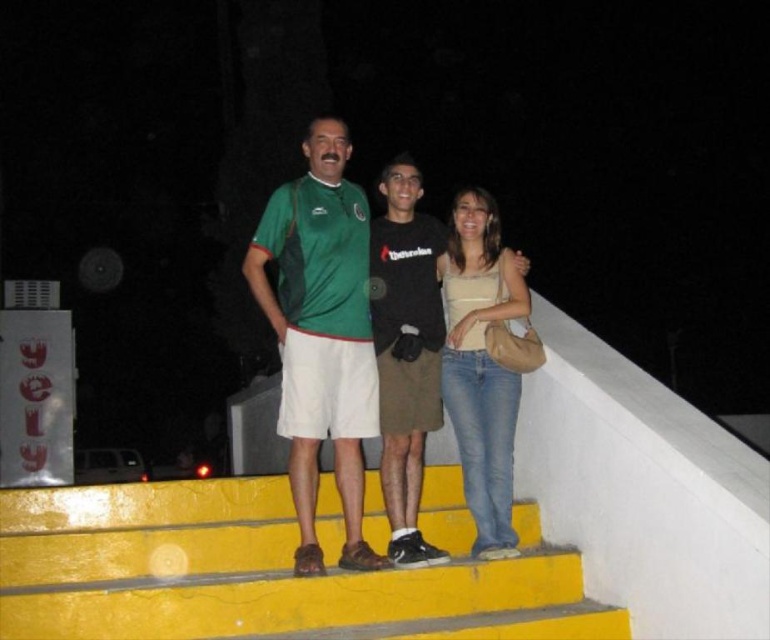
Question: Which object is positioned closest to the yellow painted stairs at center?

Choices:
 (A) green fabric shirt at center
 (B) black cotton shirt at center

Answer: (B)

Question: Considering the real-world distances, which object is closest to the denim jeans at center?

Choices:
 (A) black cotton shirt at center
 (B) yellow painted stairs at center
 (C) green fabric shirt at center

Answer: (A)

Question: Considering the relative positions of yellow painted stairs at center and black cotton shirt at center in the image provided, where is yellow painted stairs at center located with respect to black cotton shirt at center?

Choices:
 (A) below
 (B) above

Answer: (A)

Question: Can you confirm if yellow painted stairs at center is bigger than denim jeans at center?

Choices:
 (A) no
 (B) yes

Answer: (A)

Question: Does black cotton shirt at center have a smaller size compared to denim jeans at center?

Choices:
 (A) yes
 (B) no

Answer: (A)

Question: Which point is closer to the camera taking this photo?

Choices:
 (A) (394, 552)
 (B) (357, 397)
 (C) (276, 513)
 (D) (516, 372)

Answer: (A)